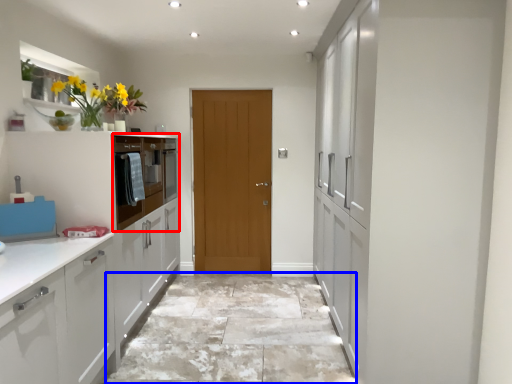
Question: Among these objects, which one is farthest to the camera, oven (highlighted by a red box) or granite (highlighted by a blue box)?

Choices:
 (A) oven
 (B) granite

Answer: (A)